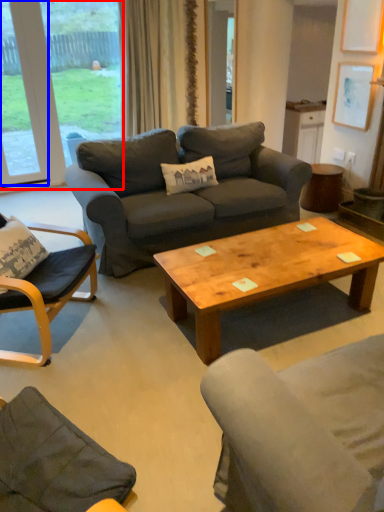
Question: Which point is closer to the camera, window (highlighted by a red box) or window (highlighted by a blue box)?

Choices:
 (A) window
 (B) window

Answer: (B)